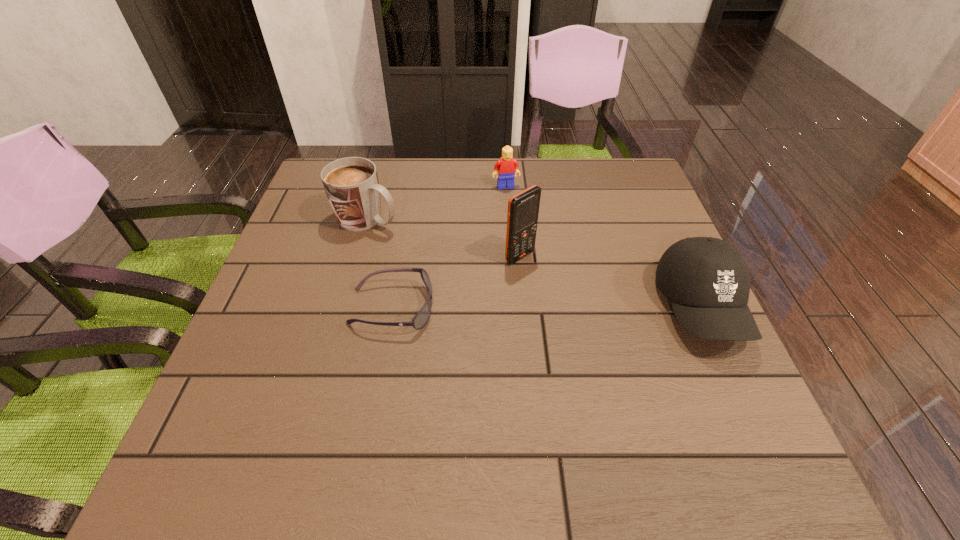
I want to click on vacant space that satisfies the following two spatial constraints: 1. on the front side of the farthest object; 2. on the right side of the tallest object, so click(x=511, y=257).